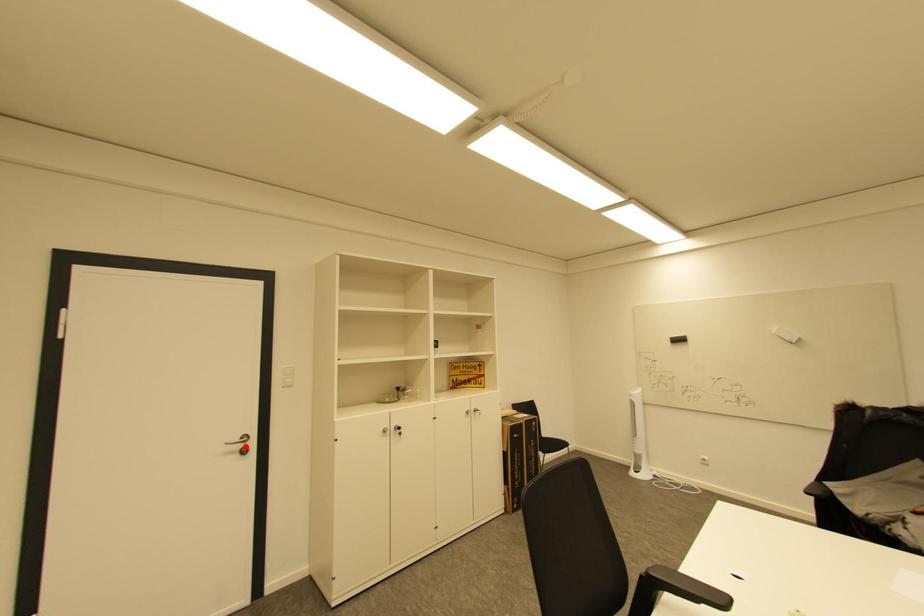
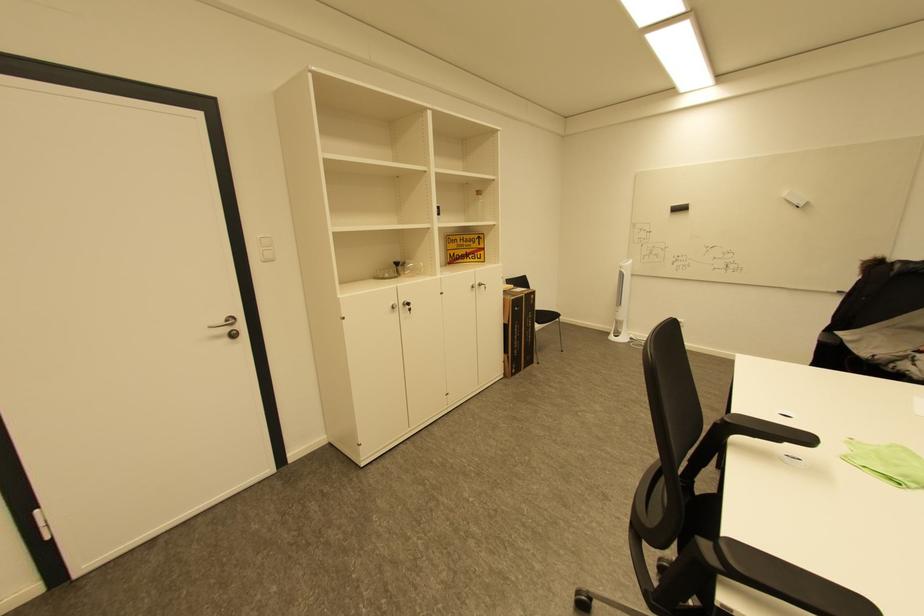
The point at the highlighted location is marked in the first image. Where is the corresponding point in the second image?

(233, 330)